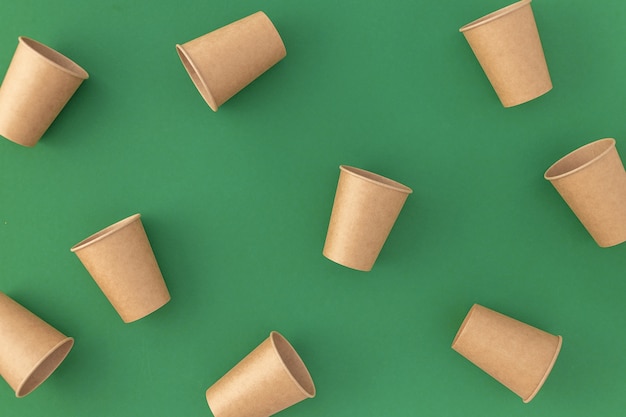
Identify the location of brown cup. This screenshot has height=417, width=626. (508, 347), (255, 374), (364, 220), (126, 270), (12, 348), (590, 208), (501, 62), (232, 50), (33, 94).